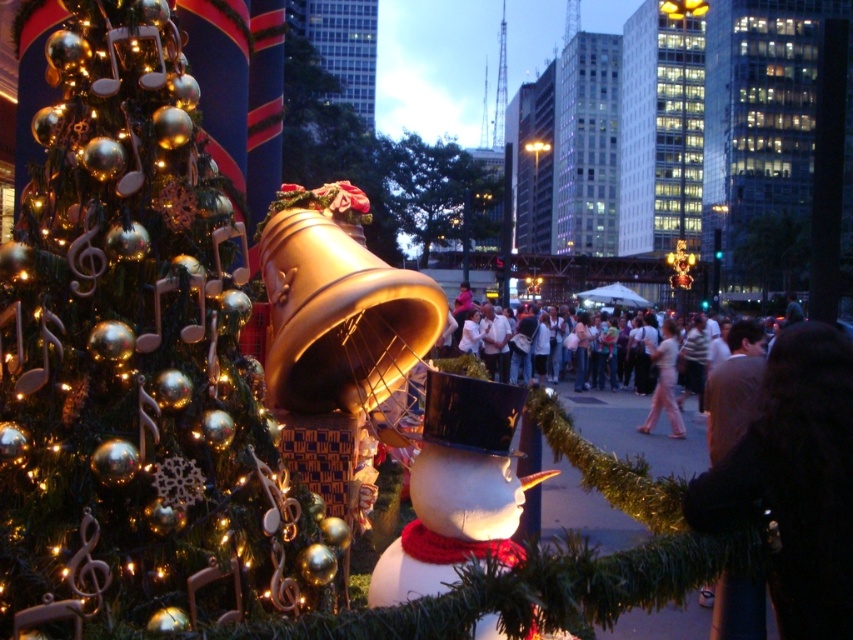
You are standing in front of the festive scene and want to place a gift between the white matte snowman at center and the pink fabric pants at center. Which side of the snowman should you place it to ensure it is between them?

You should place the gift to the right of the white matte snowman at center since the pink fabric pants at center is located to its right, ensuring the gift is between them.

You are a visitor at the festive scene and want to take a photo of both the shiny gold ornaments at left and the white matte snowman at center. Which object should you focus on first if you want to capture both in the same frame without moving the camera?

You should focus on the white matte snowman at center first because the shiny gold ornaments at left is located above it, so adjusting the camera angle to include both would require ensuring the upper area where the ornaments are placed is within the frame.